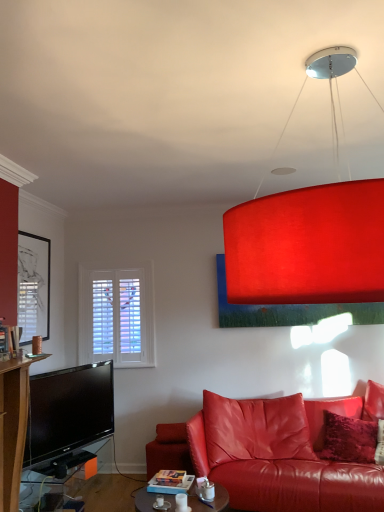
The height and width of the screenshot is (512, 384). Describe the element at coordinates (275, 458) in the screenshot. I see `matte leather couch at lower right` at that location.

What are the coordinates of `matte black picture frame at left` in the screenshot? It's located at (33, 286).

What do you see at coordinates (208, 503) in the screenshot? I see `matte glass coffee table at center, marked as the 1th table in a right-to-left arrangement` at bounding box center [208, 503].

The width and height of the screenshot is (384, 512). What do you see at coordinates (58, 480) in the screenshot? I see `matte black tv stand at lower left, the second table viewed from the right` at bounding box center [58, 480].

This screenshot has width=384, height=512. What do you see at coordinates (349, 439) in the screenshot? I see `velvet red pillow at lower right` at bounding box center [349, 439].

Where is `matte red lampshade at upper center`? matte red lampshade at upper center is located at coordinates (307, 246).

Is matte red lampshade at upper center smaller than matte leather couch at lower right?

Yes.

Considering the sizes of objects matte red lampshade at upper center and matte leather couch at lower right in the image provided, who is thinner, matte red lampshade at upper center or matte leather couch at lower right?

matte red lampshade at upper center is thinner.

Is matte red lampshade at upper center oriented away from matte leather couch at lower right?

matte red lampshade at upper center does not have its back to matte leather couch at lower right.

Is matte red lampshade at upper center completely or partially outside of matte leather couch at lower right?

Indeed, matte red lampshade at upper center is completely outside matte leather couch at lower right.

Can you tell me how much matte black tv stand at lower left, the second table viewed from the right, and matte leather couch at lower right differ in facing direction?

The facing directions of matte black tv stand at lower left, the second table viewed from the right, and matte leather couch at lower right are 102 degrees apart.

Is the position of matte black tv stand at lower left, which appears as the first table when viewed from the left, less distant than that of matte leather couch at lower right?

No.

Is matte black tv stand at lower left, the second table viewed from the right, facing towards matte leather couch at lower right?

Yes, matte black tv stand at lower left, the second table viewed from the right, is turned towards matte leather couch at lower right.

Is matte black tv stand at lower left, which appears as the first table when viewed from the left, not near matte leather couch at lower right?

That's right, there is a large distance between matte black tv stand at lower left, which appears as the first table when viewed from the left, and matte leather couch at lower right.

From the image's perspective, is matte leather couch at lower right located above matte black picture frame at left?

No, from the image's perspective, matte leather couch at lower right is not over matte black picture frame at left.

Is matte leather couch at lower right to the left or to the right of matte black picture frame at left in the image?

Clearly, matte leather couch at lower right is on the right of matte black picture frame at left in the image.

Where is `picture frame that is behind the matte leather couch at lower right`? This screenshot has width=384, height=512. picture frame that is behind the matte leather couch at lower right is located at coordinates (33, 286).

Considering the relative sizes of matte leather couch at lower right and matte black picture frame at left in the image provided, is matte leather couch at lower right wider than matte black picture frame at left?

Yes.

Which object is further away from the camera taking this photo, matte black picture frame at left or matte glass coffee table at center, marked as the 1th table in a right-to-left arrangement?

matte black picture frame at left is further away from the camera.

Is matte black picture frame at left to the right of matte glass coffee table at center, marked as the 1th table in a right-to-left arrangement, from the viewer's perspective?

No, matte black picture frame at left is not to the right of matte glass coffee table at center, marked as the 1th table in a right-to-left arrangement.

From a real-world perspective, which object stands above the other?

In real-world perspective, matte black picture frame at left is above.

Considering the positions of point (18, 286) and point (218, 498), is point (18, 286) closer or farther from the camera than point (218, 498)?

Point (18, 286).

Is velvet red pillow at lower right shorter than matte black tv stand at lower left, which appears as the first table when viewed from the left?

No.

From a real-world perspective, does velvet red pillow at lower right sit lower than matte black tv stand at lower left, which appears as the first table when viewed from the left?

No, from a real-world perspective, velvet red pillow at lower right is not below matte black tv stand at lower left, which appears as the first table when viewed from the left.

From the image's perspective, between velvet red pillow at lower right and matte black tv stand at lower left, the second table viewed from the right, who is located below?

matte black tv stand at lower left, the second table viewed from the right, from the image's perspective.

From the picture: Measure the distance from velvet red pillow at lower right to matte black tv stand at lower left, the second table viewed from the right.

A distance of 2.23 meters exists between velvet red pillow at lower right and matte black tv stand at lower left, the second table viewed from the right.

From a real-world perspective, is matte leather couch at lower right positioned over velvet red pillow at lower right based on gravity?

No.

Consider the image. Which is more to the left, matte leather couch at lower right or velvet red pillow at lower right?

matte leather couch at lower right.

Can you confirm if matte leather couch at lower right is thinner than velvet red pillow at lower right?

In fact, matte leather couch at lower right might be wider than velvet red pillow at lower right.

Between matte leather couch at lower right and matte glass coffee table at center, marked as the 1th table in a right-to-left arrangement, which one appears on the left side from the viewer's perspective?

matte glass coffee table at center, marked as the 1th table in a right-to-left arrangement, is more to the left.

Is matte leather couch at lower right not near matte glass coffee table at center, the 2th table when ordered from left to right?

No.

From a real-world perspective, is matte leather couch at lower right on top of matte glass coffee table at center, the 2th table when ordered from left to right?

Yes.

Find the location of `studio couch located below the matte red lampshade at upper center (from the image's perspective)`. studio couch located below the matte red lampshade at upper center (from the image's perspective) is located at coordinates (275, 458).

Identify the location of studio couch located on the right of matte black tv stand at lower left, which appears as the first table when viewed from the left. This screenshot has height=512, width=384. (275, 458).

Based on their spatial positions, is matte black picture frame at left or matte black tv stand at lower left, which appears as the first table when viewed from the left, further from matte leather couch at lower right?

Among the two, matte black picture frame at left is located further to matte leather couch at lower right.

When comparing their distances from matte leather couch at lower right, does matte red lampshade at upper center or matte glass coffee table at center, marked as the 1th table in a right-to-left arrangement, seem further?

Among the two, matte red lampshade at upper center is located further to matte leather couch at lower right.

Estimate the real-world distances between objects in this image. Which object is further from matte leather couch at lower right, matte glass coffee table at center, marked as the 1th table in a right-to-left arrangement, or matte red lampshade at upper center?

matte red lampshade at upper center lies further to matte leather couch at lower right than the other object.

Looking at this image, when comparing their distances from matte black tv stand at lower left, the second table viewed from the right, does matte red lampshade at upper center or velvet red pillow at lower right seem further?

matte red lampshade at upper center lies further to matte black tv stand at lower left, the second table viewed from the right, than the other object.

Based on their spatial positions, is matte black picture frame at left or matte glass coffee table at center, marked as the 1th table in a right-to-left arrangement, further from matte leather couch at lower right?

matte black picture frame at left lies further to matte leather couch at lower right than the other object.

Estimate the real-world distances between objects in this image. Which object is closer to matte leather couch at lower right, matte glass coffee table at center, the 2th table when ordered from left to right, or matte black picture frame at left?

matte glass coffee table at center, the 2th table when ordered from left to right, is closer to matte leather couch at lower right.

Estimate the real-world distances between objects in this image. Which object is closer to matte red lampshade at upper center, matte glass coffee table at center, marked as the 1th table in a right-to-left arrangement, or velvet red pillow at lower right?

matte glass coffee table at center, marked as the 1th table in a right-to-left arrangement, is positioned closer to the anchor matte red lampshade at upper center.

Which object lies nearer to the anchor point matte black picture frame at left, velvet red pillow at lower right or matte leather couch at lower right?

matte leather couch at lower right.

The width and height of the screenshot is (384, 512). Identify the location of pillow between matte red lampshade at upper center and matte glass coffee table at center, the 2th table when ordered from left to right, in the up-down direction. (349, 439).

Where is `lamp between matte black picture frame at left and matte leather couch at lower right in the horizontal direction`? The width and height of the screenshot is (384, 512). lamp between matte black picture frame at left and matte leather couch at lower right in the horizontal direction is located at coordinates (307, 246).

The height and width of the screenshot is (512, 384). I want to click on table between matte black tv stand at lower left, which appears as the first table when viewed from the left, and velvet red pillow at lower right, so click(x=208, y=503).

Where is `lamp between matte black tv stand at lower left, the second table viewed from the right, and velvet red pillow at lower right from left to right`? The width and height of the screenshot is (384, 512). lamp between matte black tv stand at lower left, the second table viewed from the right, and velvet red pillow at lower right from left to right is located at coordinates (307, 246).